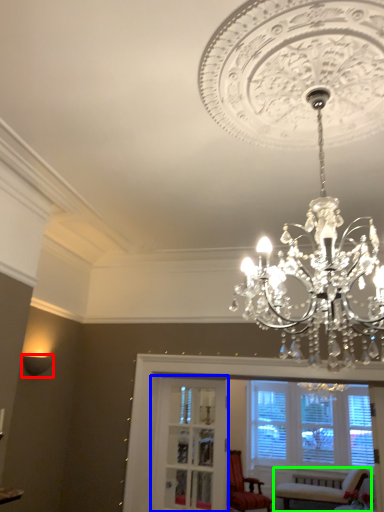
Question: Based on their relative distances, which object is nearer to lamp (highlighted by a red box)? Choose from glass door (highlighted by a blue box) and chair (highlighted by a green box).

Choices:
 (A) glass door
 (B) chair

Answer: (A)